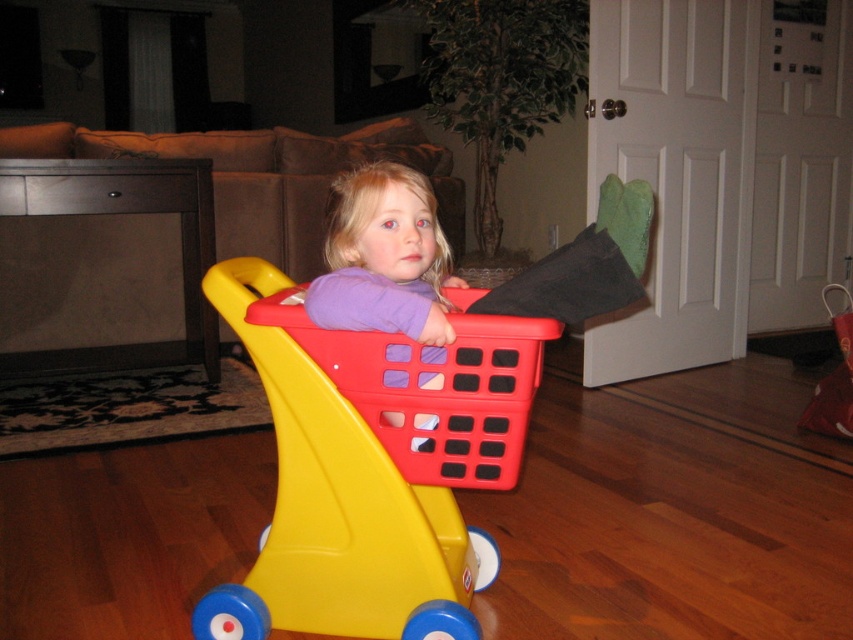
Question: Which object appears closest to the camera in this image?

Choices:
 (A) matte plastic shopping cart at center
 (B) red plastic basket at center

Answer: (B)

Question: Observing the image, what is the correct spatial positioning of matte plastic shopping cart at center in reference to red plastic basket at center?

Choices:
 (A) above
 (B) below

Answer: (B)

Question: Which point is farther from the camera taking this photo?

Choices:
 (A) (450, 428)
 (B) (466, 616)

Answer: (A)

Question: Which point is farther from the camera taking this photo?

Choices:
 (A) (387, 529)
 (B) (448, 474)

Answer: (B)

Question: Observing the image, what is the correct spatial positioning of matte plastic shopping cart at center in reference to red plastic basket at center?

Choices:
 (A) above
 (B) below

Answer: (B)

Question: Does matte plastic shopping cart at center appear on the right side of red plastic basket at center?

Choices:
 (A) no
 (B) yes

Answer: (A)